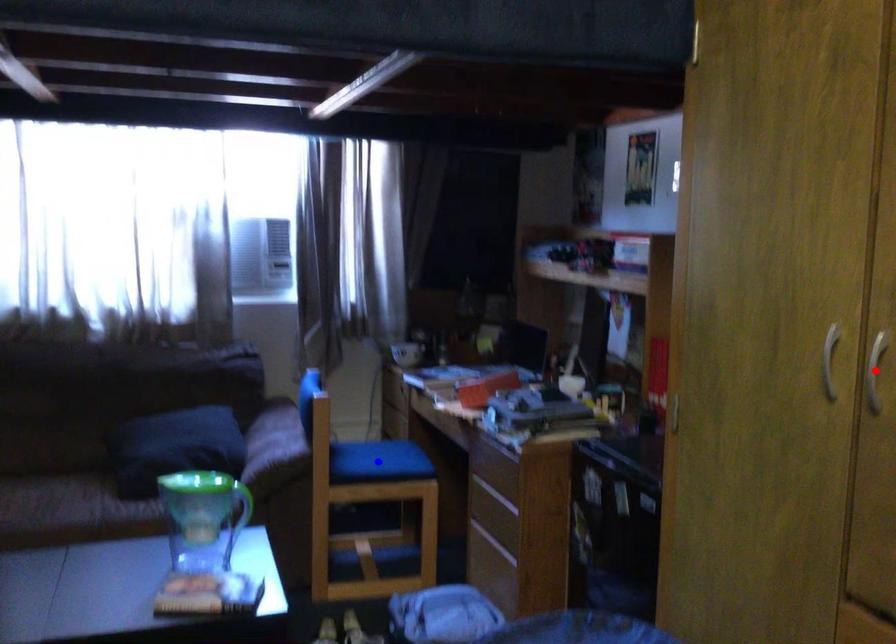
Question: In the image, two points are highlighted. Which point is nearer to the camera? Reply with the corresponding letter.

Choices:
 (A) blue point
 (B) red point

Answer: (B)